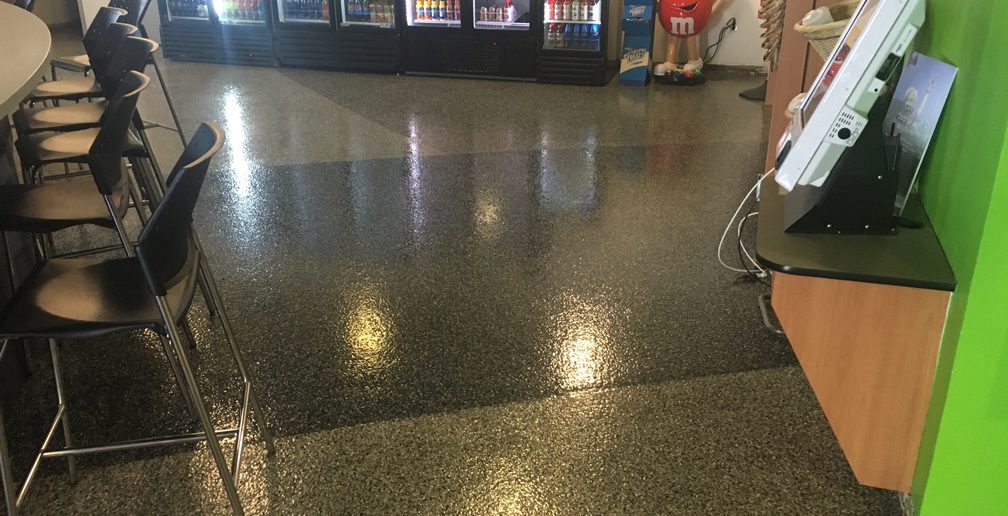
This screenshot has height=516, width=1008. Find the location of `refrigerated cases`. refrigerated cases is located at coordinates (573, 66), (504, 52), (376, 54), (296, 44), (226, 55), (175, 42), (452, 42).